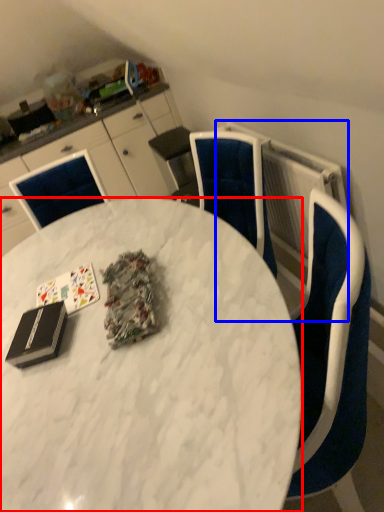
Question: Which of the following is the closest to the observer, desk (highlighted by a red box) or radiator (highlighted by a blue box)?

Choices:
 (A) desk
 (B) radiator

Answer: (A)